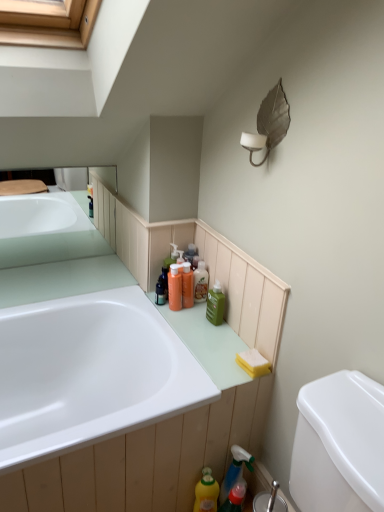
What is the approximate height of green matte bottle at upper right, the third cleaning product ordered from the bottom?

green matte bottle at upper right, the third cleaning product ordered from the bottom, is 6.18 inches in height.

Locate an element on the screen. yellow matte bottle at lower center, which is counted as the 1th cleaning product, starting from the bottom is located at coordinates (206, 492).

Describe the element at coordinates (269, 123) in the screenshot. I see `metallic leaf-shaped light fixture at upper right` at that location.

Describe the element at coordinates (235, 471) in the screenshot. I see `translucent plastic spray bottle at lower center, the 2th cleaning product ordered from the bottom` at that location.

Measure the distance between point (70, 406) and camera.

A distance of 5.30 feet exists between point (70, 406) and camera.

Image resolution: width=384 pixels, height=512 pixels. I want to click on green matte bottle at upper right, the third cleaning product ordered from the bottom, so click(x=215, y=304).

Choose the correct answer: Is translucent plastic spray bottle at lower center, positioned as the second cleaning product in top-to-bottom order, inside white glossy bathtub at lower left or outside it?

translucent plastic spray bottle at lower center, positioned as the second cleaning product in top-to-bottom order, is spatially situated outside white glossy bathtub at lower left.

Which is in front, translucent plastic spray bottle at lower center, the 2th cleaning product ordered from the bottom, or white glossy bathtub at lower left?

white glossy bathtub at lower left is more forward.

Is translucent plastic spray bottle at lower center, the 2th cleaning product ordered from the bottom, oriented towards white glossy bathtub at lower left?

No.

Can you confirm if translucent plastic spray bottle at lower center, the 2th cleaning product ordered from the bottom, is taller than white glossy bathtub at lower left?

No, translucent plastic spray bottle at lower center, the 2th cleaning product ordered from the bottom, is not taller than white glossy bathtub at lower left.

From a real-world perspective, which object stands above the other?

metallic leaf-shaped light fixture at upper right.

Between yellow matte bottle at lower center, which is counted as the 1th cleaning product, starting from the bottom, and metallic leaf-shaped light fixture at upper right, which one has more height?

With more height is metallic leaf-shaped light fixture at upper right.

Is yellow matte bottle at lower center, the third cleaning product viewed from the top, at the left side of metallic leaf-shaped light fixture at upper right?

Indeed, yellow matte bottle at lower center, the third cleaning product viewed from the top, is positioned on the left side of metallic leaf-shaped light fixture at upper right.

Locate an element on the screen. The height and width of the screenshot is (512, 384). light fixture in front of the yellow matte bottle at lower center, the third cleaning product viewed from the top is located at coordinates (x=269, y=123).

Can you confirm if green matte bottle at upper right, the third cleaning product ordered from the bottom, is thinner than translucent plastic spray bottle at lower center, the 2th cleaning product ordered from the bottom?

Indeed, green matte bottle at upper right, the third cleaning product ordered from the bottom, has a lesser width compared to translucent plastic spray bottle at lower center, the 2th cleaning product ordered from the bottom.

From the image's perspective, between green matte bottle at upper right, placed as the 1th cleaning product when sorted from top to bottom, and translucent plastic spray bottle at lower center, positioned as the second cleaning product in top-to-bottom order, who is located below?

From the image's view, translucent plastic spray bottle at lower center, positioned as the second cleaning product in top-to-bottom order, is below.

Where is `cleaning product above the translucent plastic spray bottle at lower center, positioned as the second cleaning product in top-to-bottom order (from a real-world perspective)`? The width and height of the screenshot is (384, 512). cleaning product above the translucent plastic spray bottle at lower center, positioned as the second cleaning product in top-to-bottom order (from a real-world perspective) is located at coordinates (215, 304).

Is point (219, 323) behind point (230, 480)?

That is True.

Considering the sizes of orange plastic bottles at center, which is counted as the second toiletry, starting from the right, and yellow sponge at lower right in the image, is orange plastic bottles at center, which is counted as the second toiletry, starting from the right, taller or shorter than yellow sponge at lower right?

Clearly, orange plastic bottles at center, which is counted as the second toiletry, starting from the right, is taller compared to yellow sponge at lower right.

From a real-world perspective, does orange plastic bottles at center, which is the first toiletry from left to right, stand above yellow sponge at lower right?

Yes, from a real-world perspective, orange plastic bottles at center, which is the first toiletry from left to right, is above yellow sponge at lower right.

The image size is (384, 512). In order to click on the 1st toiletry behind the yellow sponge at lower right in this screenshot , I will do `click(175, 288)`.

From a real-world perspective, is metallic leaf-shaped light fixture at upper right physically below translucent plastic spray bottle at lower center, the 2th cleaning product ordered from the bottom?

Actually, metallic leaf-shaped light fixture at upper right is physically above translucent plastic spray bottle at lower center, the 2th cleaning product ordered from the bottom, in the real world.

Locate an element on the screen. the 2nd cleaning product located beneath the metallic leaf-shaped light fixture at upper right (from a real-world perspective) is located at coordinates (235, 471).

From a real-world perspective, is white glossy bathtub at lower left positioned under orange plastic bottles at center, which is the first toiletry from left to right, based on gravity?

Yes, from a real-world perspective, white glossy bathtub at lower left is below orange plastic bottles at center, which is the first toiletry from left to right.

Looking at this image, can you confirm if white glossy bathtub at lower left is shorter than orange plastic bottles at center, which is counted as the second toiletry, starting from the right?

No.

How many degrees apart are the facing directions of white glossy bathtub at lower left and orange plastic bottles at center, which is the first toiletry from left to right?

87.4 degrees.

Is white glossy bathtub at lower left oriented away from orange plastic bottles at center, which is counted as the second toiletry, starting from the right?

white glossy bathtub at lower left does not have its back to orange plastic bottles at center, which is counted as the second toiletry, starting from the right.

Where is `the 1st cleaning product below the metallic leaf-shaped light fixture at upper right (from the image's perspective)`? The width and height of the screenshot is (384, 512). the 1st cleaning product below the metallic leaf-shaped light fixture at upper right (from the image's perspective) is located at coordinates [215, 304].

Based on their sizes in the image, would you say metallic leaf-shaped light fixture at upper right is bigger or smaller than green matte bottle at upper right, the third cleaning product ordered from the bottom?

In the image, metallic leaf-shaped light fixture at upper right appears to be larger than green matte bottle at upper right, the third cleaning product ordered from the bottom.

Would you say metallic leaf-shaped light fixture at upper right is outside green matte bottle at upper right, the third cleaning product ordered from the bottom?

Yes, metallic leaf-shaped light fixture at upper right is located beyond the bounds of green matte bottle at upper right, the third cleaning product ordered from the bottom.

The height and width of the screenshot is (512, 384). In order to click on the 3rd cleaning product counting from the right side of the white glossy bathtub at lower left in this screenshot , I will do `click(235, 471)`.

Where is `light fixture lying in front of the yellow matte bottle at lower center, the third cleaning product viewed from the top`? light fixture lying in front of the yellow matte bottle at lower center, the third cleaning product viewed from the top is located at coordinates (269, 123).

Considering their positions, is translucent orange bottle at center, positioned as the 1th toiletry in right-to-left order, positioned further to white glossy bathtub at lower left than green matte bottle at upper right, the third cleaning product ordered from the bottom?

Based on the image, translucent orange bottle at center, positioned as the 1th toiletry in right-to-left order, appears to be further to white glossy bathtub at lower left.

Based on the photo, from the image, which object appears to be nearer to yellow sponge at lower right, translucent plastic spray bottle at lower center, the 2th cleaning product ordered from the bottom, or translucent orange bottle at center, positioned as the 1th toiletry in right-to-left order?

translucent plastic spray bottle at lower center, the 2th cleaning product ordered from the bottom, is closer to yellow sponge at lower right.

From the image, which object appears to be farther from yellow sponge at lower right, orange plastic bottles at center, which is the first toiletry from left to right, or white glossy bathtub at lower left?

Based on the image, white glossy bathtub at lower left appears to be further to yellow sponge at lower right.

From the image, which object appears to be farther from translucent plastic spray bottle at lower center, the 2th cleaning product ordered from the bottom, white glossy bathtub at lower left or orange plastic bottles at center, which is counted as the second toiletry, starting from the right?

orange plastic bottles at center, which is counted as the second toiletry, starting from the right, is further to translucent plastic spray bottle at lower center, the 2th cleaning product ordered from the bottom.

When comparing their distances from green matte bottle at upper right, the third cleaning product ordered from the bottom, does translucent plastic spray bottle at lower center, positioned as the second cleaning product in top-to-bottom order, or translucent orange bottle at center, positioned as the 1th toiletry in right-to-left order, seem further?

translucent plastic spray bottle at lower center, positioned as the second cleaning product in top-to-bottom order.

From the image, which object appears to be nearer to metallic leaf-shaped light fixture at upper right, white glossy bathtub at lower left or orange plastic bottles at center, which is counted as the second toiletry, starting from the right?

orange plastic bottles at center, which is counted as the second toiletry, starting from the right, lies closer to metallic leaf-shaped light fixture at upper right than the other object.

Which object lies nearer to the anchor point white glossy bathtub at lower left, green matte bottle at upper right, placed as the 1th cleaning product when sorted from top to bottom, or orange plastic bottles at center, which is counted as the second toiletry, starting from the right?

orange plastic bottles at center, which is counted as the second toiletry, starting from the right, lies closer to white glossy bathtub at lower left than the other object.

Considering their positions, is green matte bottle at upper right, the third cleaning product ordered from the bottom, positioned further to yellow sponge at lower right than metallic leaf-shaped light fixture at upper right?

metallic leaf-shaped light fixture at upper right is further to yellow sponge at lower right.

The height and width of the screenshot is (512, 384). Identify the location of soap between orange plastic bottles at center, which is the first toiletry from left to right, and translucent plastic spray bottle at lower center, positioned as the second cleaning product in top-to-bottom order, in the up-down direction. (253, 362).

Identify the location of soap between white glossy bathtub at lower left and green matte bottle at upper right, placed as the 1th cleaning product when sorted from top to bottom, from front to back. The image size is (384, 512). (253, 362).

The image size is (384, 512). I want to click on bathtub between translucent orange bottle at center, which is the 2th toiletry from left to right, and translucent plastic spray bottle at lower center, positioned as the second cleaning product in top-to-bottom order, vertically, so click(89, 373).

This screenshot has width=384, height=512. What are the coordinates of `toiletry between metallic leaf-shaped light fixture at upper right and translucent orange bottle at center, positioned as the 1th toiletry in right-to-left order, from front to back` in the screenshot? It's located at 175,288.